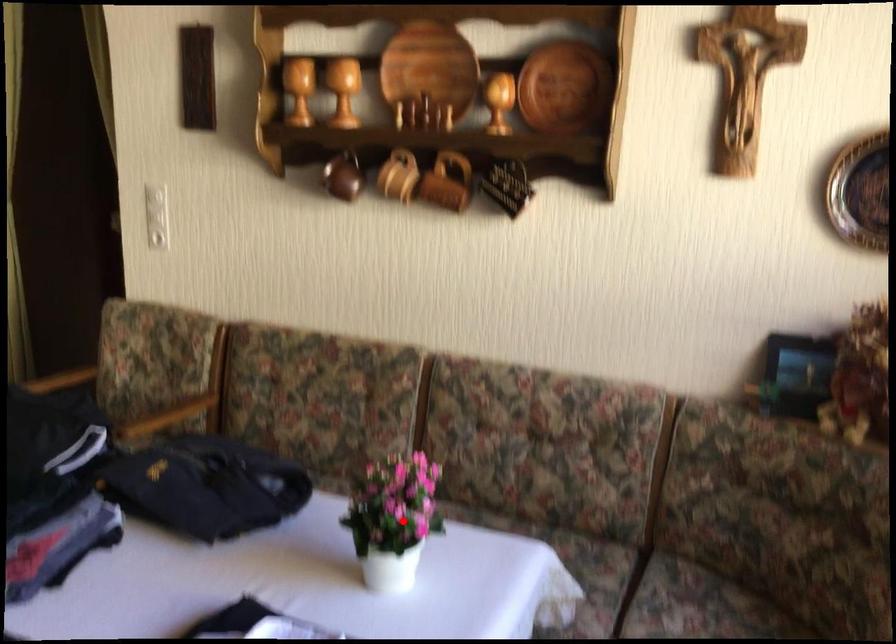
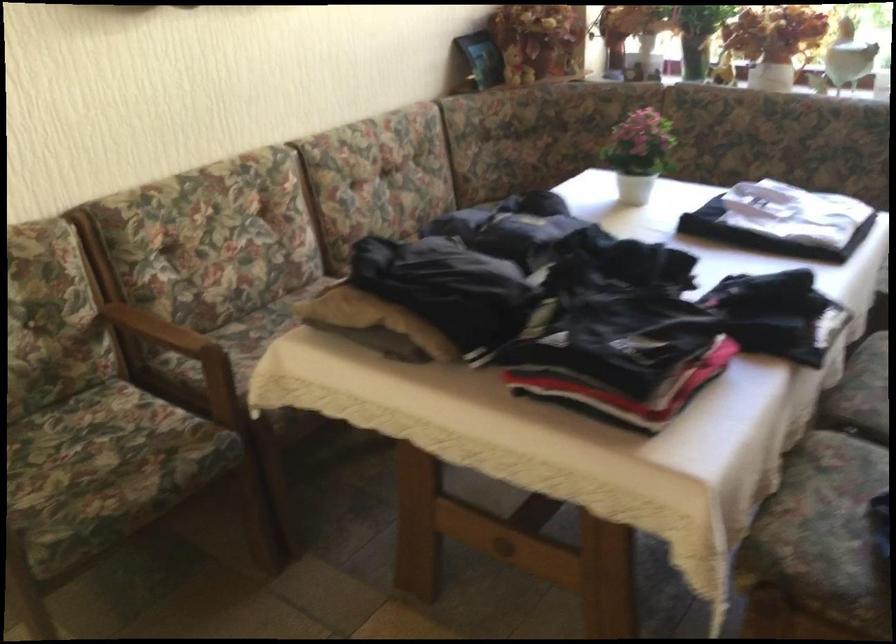
Question: I am providing you with two images of the same scene from different viewpoints. Given a red point in image1, look at the same physical point in image2. Is it:

Choices:
 (A) Closer to the viewpoint
 (B) Farther from the viewpoint

Answer: (B)